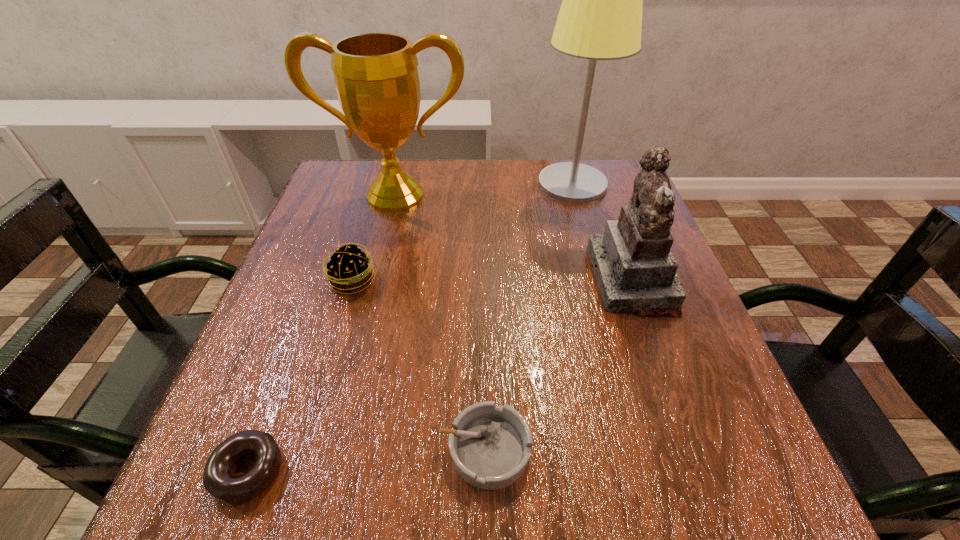
Locate an element on the screen. This screenshot has height=540, width=960. vacant region located on the front-facing side of the figurine is located at coordinates (469, 280).

The width and height of the screenshot is (960, 540). In order to click on blank space located 0.400m on the right of the fourth tallest object in this screenshot , I will do `click(575, 280)`.

You are a GUI agent. You are given a task and a screenshot of the screen. Output one action in this format:
    pyautogui.click(x=<x>, y=<y>)
    Task: Click on the free spot located 0.230m on the left of the ashtray
    This screenshot has width=960, height=540.
    Given the screenshot: What is the action you would take?
    pyautogui.click(x=280, y=449)

Locate an element on the screen. The height and width of the screenshot is (540, 960). vacant point located on the back of the doughnut is located at coordinates (310, 307).

At what (x,y) coordinates should I click in order to perform the action: click on table lamp located in the far edge section of the desktop. Please return your answer as a coordinate pair (x, y). This screenshot has height=540, width=960. Looking at the image, I should click on (600, 18).

Identify the location of award that is at the far edge. (376, 77).

Image resolution: width=960 pixels, height=540 pixels. Find the location of `ashtray that is at the near edge`. ashtray that is at the near edge is located at coordinates (490, 446).

Identify the location of doughnut situated at the near edge. The image size is (960, 540). (219, 481).

Where is `award at the left edge`? award at the left edge is located at coordinates [x=376, y=77].

At what (x,y) coordinates should I click in order to perform the action: click on patty situated at the left edge. Please return your answer as a coordinate pair (x, y). Looking at the image, I should click on (348, 269).